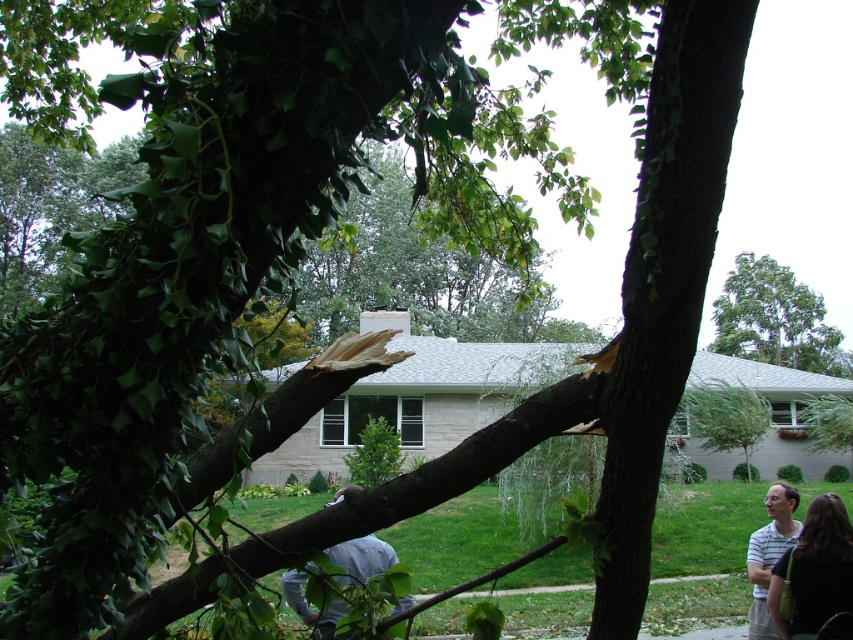
Who is shorter, green leafy tree at upper center or dark brown hair at lower right?

With less height is dark brown hair at lower right.

Can you confirm if green leafy tree at upper center is positioned above dark brown hair at lower right?

Indeed, green leafy tree at upper center is positioned over dark brown hair at lower right.

Who is more forward, (830, 374) or (814, 541)?

Point (814, 541)

The width and height of the screenshot is (853, 640). In order to click on green leafy tree at upper center in this screenshot , I will do `click(775, 320)`.

Can you confirm if dark brown hair at lower right is positioned above striped cotton shirt at lower right?

Yes.

Which is behind, point (822, 612) or point (767, 621)?

Positioned behind is point (767, 621).

Where is `dark brown hair at lower right`? This screenshot has width=853, height=640. dark brown hair at lower right is located at coordinates (815, 570).

From the picture: Which is below, light gray fabric shirt at lower center or striped cotton shirt at lower right?

striped cotton shirt at lower right is lower down.

Who is shorter, light gray fabric shirt at lower center or striped cotton shirt at lower right?

striped cotton shirt at lower right

Is point (291, 593) positioned after point (786, 522)?

No, (291, 593) is closer to viewer.

The height and width of the screenshot is (640, 853). I want to click on light gray fabric shirt at lower center, so click(x=361, y=557).